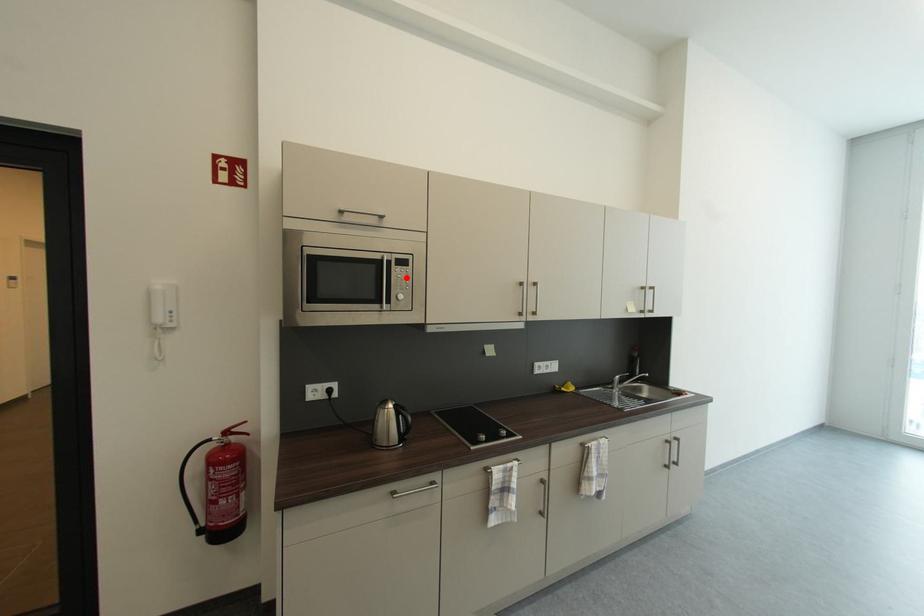
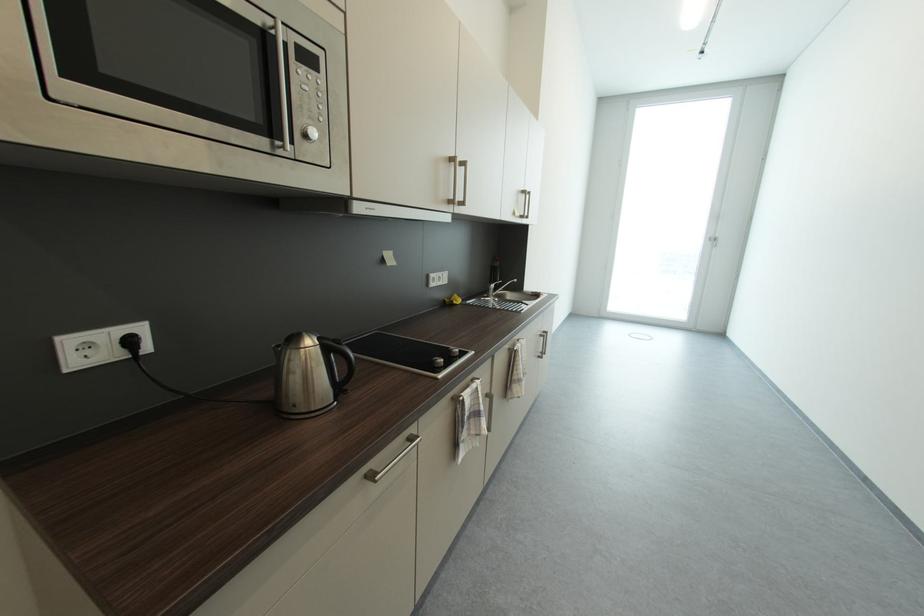
In the second image, find the point that corresponds to the highlighted location in the first image.

(313, 89)